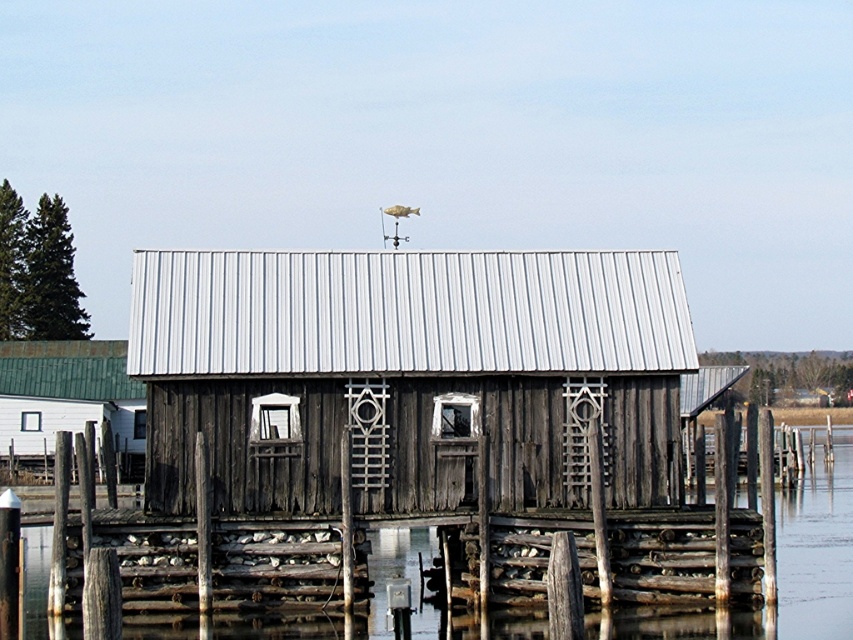
You are standing on the dock and looking at the transparent wooden water at lower center and the green wooden hut at left. Which object appears taller from your viewpoint?

The green wooden hut at left appears taller than the transparent wooden water at lower center because the description states that the transparent wooden water has a lesser height compared to the green wooden hut.

You are a visitor approaching the cabin and want to know where the transparent wooden water at lower center is in relation to the green wooden hut at left. Can you describe its position?

The transparent wooden water at lower center is located below the green wooden hut at left, meaning it is positioned lower down relative to the hut.

You are standing on the dock and see the wooden cabin at center and the transparent wooden water at lower center. Which object is positioned to the left side?

The wooden cabin at center is to the left of the transparent wooden water at lower center, so the wooden cabin at center is positioned to the left side.